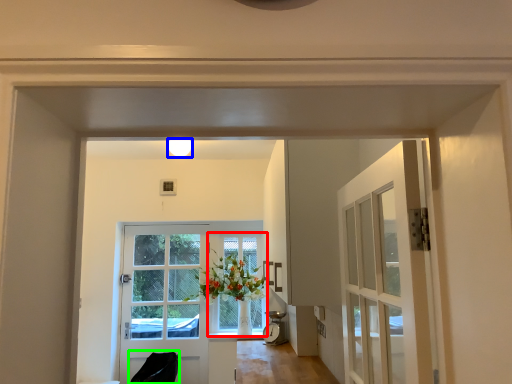
Question: Which is farther away from window (highlighted by a red box)? light fixture (highlighted by a blue box) or chair (highlighted by a green box)?

Choices:
 (A) light fixture
 (B) chair

Answer: (A)